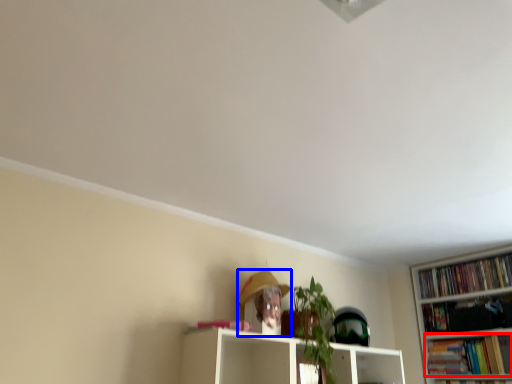
Question: Among these objects, which one is farthest to the camera, book (highlighted by a red box) or person (highlighted by a blue box)?

Choices:
 (A) book
 (B) person

Answer: (A)